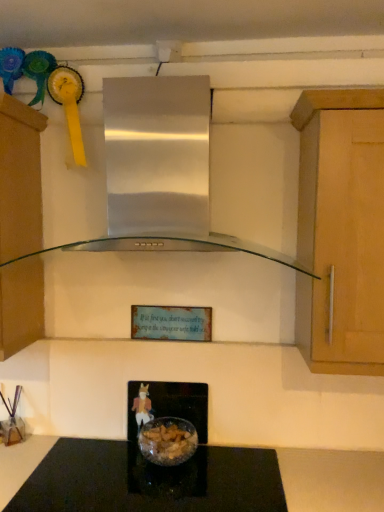
This screenshot has width=384, height=512. In order to click on free space underneath stainless steel range hood at center (from a real-world perspective) in this screenshot , I will do `click(117, 471)`.